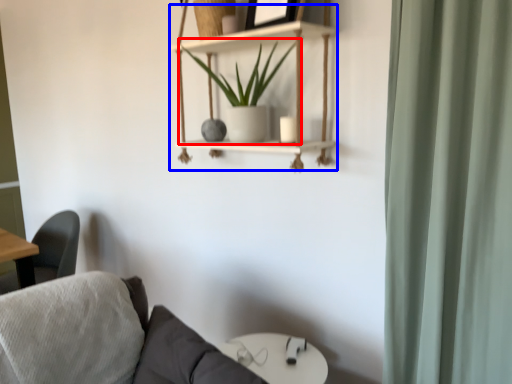
Question: Among these objects, which one is nearest to the camera, houseplant (highlighted by a red box) or cabinet (highlighted by a blue box)?

Choices:
 (A) houseplant
 (B) cabinet

Answer: (B)